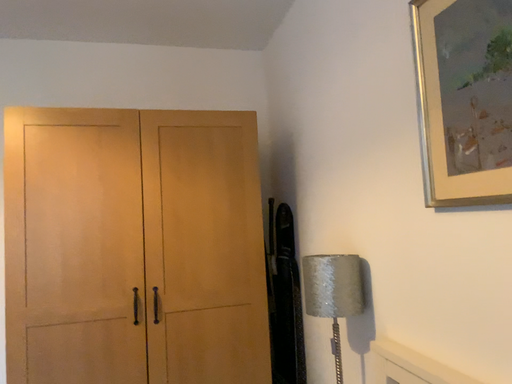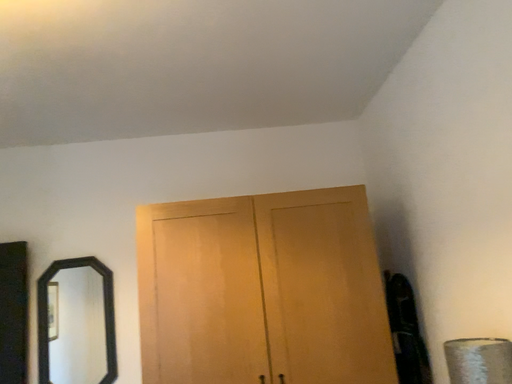
Question: Which way did the camera rotate in the video?

Choices:
 (A) rotated downward
 (B) rotated upward

Answer: (B)